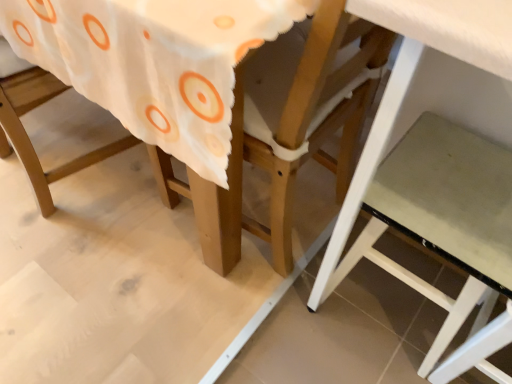
Describe the element at coordinates (265, 169) in the screenshot. The height and width of the screenshot is (384, 512). I see `wooden chair at center` at that location.

You are a GUI agent. You are given a task and a screenshot of the screen. Output one action in this format:
    pyautogui.click(x=<x>, y=<y>)
    Task: Click on the wooden chair at center
    The image size is (512, 384).
    Given the screenshot: What is the action you would take?
    click(265, 169)

Measure the distance between point (411, 147) and camera.

The depth of point (411, 147) is 86.10 centimeters.

I want to click on white matte step stool at lower right, so click(x=449, y=197).

What is the approximate height of white matte step stool at lower right?

white matte step stool at lower right is 45.12 centimeters tall.

The image size is (512, 384). Describe the element at coordinates (449, 197) in the screenshot. I see `white matte step stool at lower right` at that location.

Locate an element on the screen. wooden chair at center is located at coordinates (265, 169).

Is wooden chair at center to the left of white matte step stool at lower right from the viewer's perspective?

Correct, you'll find wooden chair at center to the left of white matte step stool at lower right.

Is wooden chair at center closer to camera compared to white matte step stool at lower right?

That is True.

Which is in front, point (229, 160) or point (479, 219)?

The point (479, 219) is more forward.

From the image's perspective, between wooden chair at center and white matte step stool at lower right, which one is located above?

wooden chair at center appears higher in the image.

From a real-world perspective, which is physically above, wooden chair at center or white matte step stool at lower right?

In real-world perspective, wooden chair at center is above.

Is wooden chair at center wider or thinner than white matte step stool at lower right?

Clearly, wooden chair at center has more width compared to white matte step stool at lower right.

Who is shorter, wooden chair at center or white matte step stool at lower right?

white matte step stool at lower right is shorter.

Considering the sizes of objects wooden chair at center and white matte step stool at lower right in the image provided, who is bigger, wooden chair at center or white matte step stool at lower right?

With larger size is wooden chair at center.

Is wooden chair at center located outside white matte step stool at lower right?

Yes, wooden chair at center is located beyond the bounds of white matte step stool at lower right.

Is wooden chair at center not close to white matte step stool at lower right?

No, wooden chair at center is not far away from white matte step stool at lower right.

Is wooden chair at center looking in the opposite direction of white matte step stool at lower right?

Yes, wooden chair at center is facing away from white matte step stool at lower right.

What are the coordinates of `chair that is above the white matte step stool at lower right (from a real-world perspective)` in the screenshot? It's located at (265, 169).

Can you confirm if white matte step stool at lower right is positioned to the left of wooden chair at center?

No, white matte step stool at lower right is not to the left of wooden chair at center.

Considering their positions, is white matte step stool at lower right located in front of or behind wooden chair at center?

In the image, white matte step stool at lower right appears behind wooden chair at center.

Between point (392, 180) and point (209, 226), which one is positioned behind?

The point (209, 226) is behind.

From the image's perspective, who appears lower, white matte step stool at lower right or wooden chair at center?

white matte step stool at lower right is shown below in the image.

From a real-world perspective, which object stands above the other?

From a 3D spatial view, wooden chair at center is above.

Considering the sizes of objects white matte step stool at lower right and wooden chair at center in the image provided, who is thinner, white matte step stool at lower right or wooden chair at center?

With smaller width is white matte step stool at lower right.

Does white matte step stool at lower right have a lesser height compared to wooden chair at center?

Yes, white matte step stool at lower right is shorter than wooden chair at center.

Who is smaller, white matte step stool at lower right or wooden chair at center?

white matte step stool at lower right.

Would you say white matte step stool at lower right is inside or outside wooden chair at center?

white matte step stool at lower right is located beyond the bounds of wooden chair at center.

Is white matte step stool at lower right touching wooden chair at center?

No, white matte step stool at lower right is not beside wooden chair at center.

Is white matte step stool at lower right looking in the opposite direction of wooden chair at center?

No, wooden chair at center is not at the back of white matte step stool at lower right.

Identify the location of step stool that is under the wooden chair at center (from a real-world perspective). This screenshot has height=384, width=512. tap(449, 197).

Locate an element on the screen. The width and height of the screenshot is (512, 384). step stool below the wooden chair at center (from a real-world perspective) is located at coordinates (449, 197).

I want to click on step stool located below the wooden chair at center (from the image's perspective), so click(x=449, y=197).